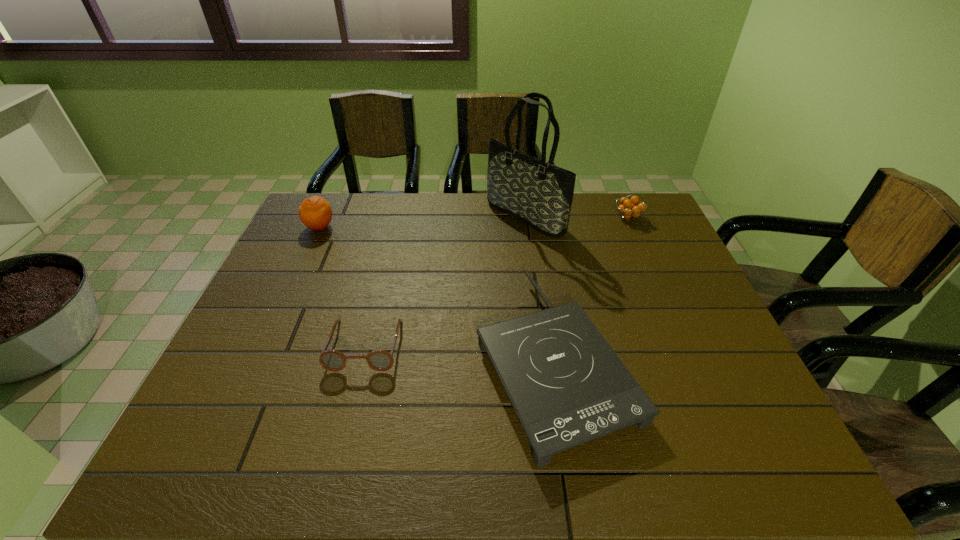
Locate an element on the screen. Image resolution: width=960 pixels, height=540 pixels. free region at the left edge of the desktop is located at coordinates (320, 271).

In the image, there is a desktop. In order to click on vacant space at the far left corner in this screenshot , I will do `click(353, 198)`.

This screenshot has width=960, height=540. Identify the location of vacant area at the far right corner. (660, 220).

At what (x,y) coordinates should I click in order to perform the action: click on blank region between the tallest object and the hotplate. Please return your answer as a coordinate pair (x, y). Looking at the image, I should click on (540, 287).

This screenshot has height=540, width=960. Find the location of `blank region between the spectacles and the hotplate`. blank region between the spectacles and the hotplate is located at coordinates (460, 351).

Where is `free space between the spectacles and the right orange fruit`? free space between the spectacles and the right orange fruit is located at coordinates (496, 281).

What are the coordinates of `unoccupied area between the spectacles and the leftmost object` in the screenshot? It's located at (343, 286).

I want to click on free space that is in between the hotplate and the tallest object, so click(x=540, y=287).

The height and width of the screenshot is (540, 960). What are the coordinates of `free space between the hotplate and the second tallest object` in the screenshot? It's located at (437, 292).

This screenshot has width=960, height=540. I want to click on unoccupied position between the leftmost object and the tote bag, so click(422, 222).